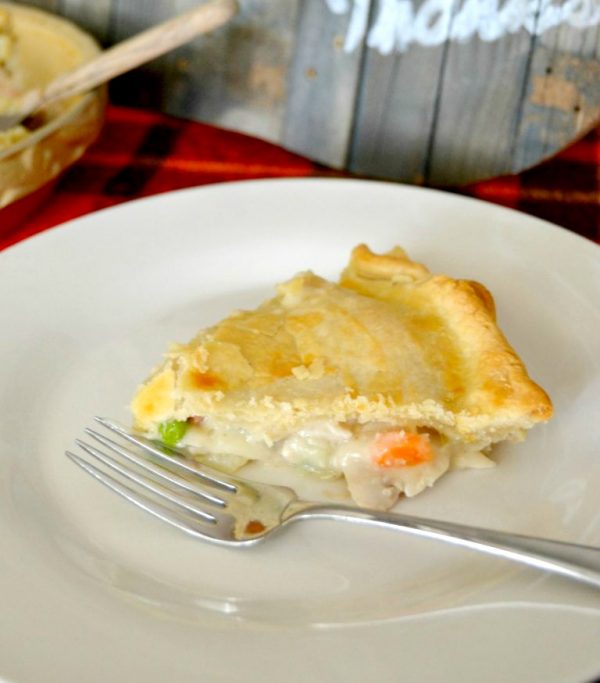
The height and width of the screenshot is (683, 600). I want to click on plate, so click(x=245, y=227).